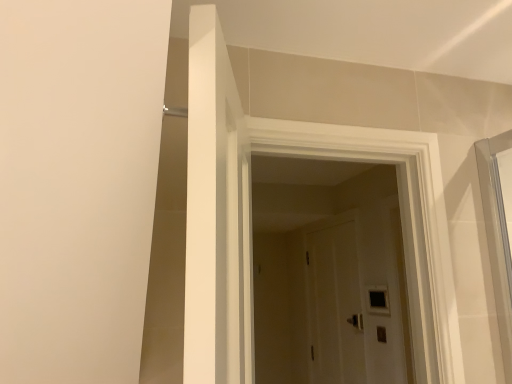
The width and height of the screenshot is (512, 384). Identify the location of white wooden door at center. (400, 199).

Describe the element at coordinates (400, 199) in the screenshot. The width and height of the screenshot is (512, 384). I see `white wooden door at center` at that location.

Where is `black glass window at center`? The image size is (512, 384). black glass window at center is located at coordinates (377, 299).

What do you see at coordinates (377, 299) in the screenshot? The image size is (512, 384). I see `black glass window at center` at bounding box center [377, 299].

What is the approximate height of black glass window at center?

It is 7.38 inches.

Where is `white wooden door at center`? white wooden door at center is located at coordinates (400, 199).

Would you say white wooden door at center is to the left or to the right of black glass window at center in the picture?

Clearly, white wooden door at center is on the left of black glass window at center in the image.

Is white wooden door at center further to camera compared to black glass window at center?

No, it is in front of black glass window at center.

Does point (399, 180) lie in front of point (387, 289)?

Yes, it is in front of point (387, 289).

From the image's perspective, which object appears higher, white wooden door at center or black glass window at center?

From the image's view, white wooden door at center is above.

From a real-world perspective, is white wooden door at center positioned over black glass window at center based on gravity?

Indeed, from a real-world perspective, white wooden door at center stands above black glass window at center.

Can you confirm if white wooden door at center is wider than black glass window at center?

Correct, the width of white wooden door at center exceeds that of black glass window at center.

Between white wooden door at center and black glass window at center, which one has less height?

Standing shorter between the two is black glass window at center.

Which of these two, white wooden door at center or black glass window at center, is smaller?

With smaller size is black glass window at center.

Looking at this image, is white wooden door at center not within black glass window at center?

Absolutely, white wooden door at center is external to black glass window at center.

Is white wooden door at center with black glass window at center?

They are not placed beside each other.

Is white wooden door at center oriented away from black glass window at center?

white wooden door at center is not turned away from black glass window at center.

In the scene shown: How different are the orientations of white wooden door at center and black glass window at center in degrees?

There is a 89.4-degree angle between the facing directions of white wooden door at center and black glass window at center.

Measure the distance between white wooden door at center and black glass window at center.

A distance of 4.22 feet exists between white wooden door at center and black glass window at center.

Find the location of a particular element. window below the white wooden door at center (from the image's perspective) is located at coordinates (377, 299).

Would you say black glass window at center is to the left or to the right of white wooden door at center in the picture?

In the image, black glass window at center appears on the right side of white wooden door at center.

Does black glass window at center come behind white wooden door at center?

Yes, black glass window at center is further from the viewer.

Is point (385, 298) positioned after point (428, 139)?

Yes, point (385, 298) is farther from viewer.

From the image's perspective, is black glass window at center beneath white wooden door at center?

Yes, from the image's perspective, black glass window at center is beneath white wooden door at center.

In the scene shown: From a real-world perspective, which is physically below, black glass window at center or white wooden door at center?

black glass window at center, from a real-world perspective.

Looking at this image, which of these two, black glass window at center or white wooden door at center, is thinner?

With smaller width is black glass window at center.

Consider the image. Can you confirm if black glass window at center is taller than white wooden door at center?

In fact, black glass window at center may be shorter than white wooden door at center.

Considering the sizes of objects black glass window at center and white wooden door at center in the image provided, who is bigger, black glass window at center or white wooden door at center?

white wooden door at center.

Based on the photo, is white wooden door at center completely or partially inside black glass window at center?

No, white wooden door at center is located outside of black glass window at center.

Is black glass window at center next to white wooden door at center and touching it?

No, black glass window at center is not beside white wooden door at center.

Is black glass window at center positioned with its back to white wooden door at center?

black glass window at center does not have its back to white wooden door at center.

How many degrees apart are the facing directions of black glass window at center and white wooden door at center?

The facing directions of black glass window at center and white wooden door at center are 89.4 degrees apart.

Find the location of a particular element. The width and height of the screenshot is (512, 384). door above the black glass window at center (from a real-world perspective) is located at coordinates (400, 199).

Locate an element on the screen. window below the white wooden door at center (from a real-world perspective) is located at coordinates (377, 299).

Locate an element on the screen. window to the right of white wooden door at center is located at coordinates (377, 299).